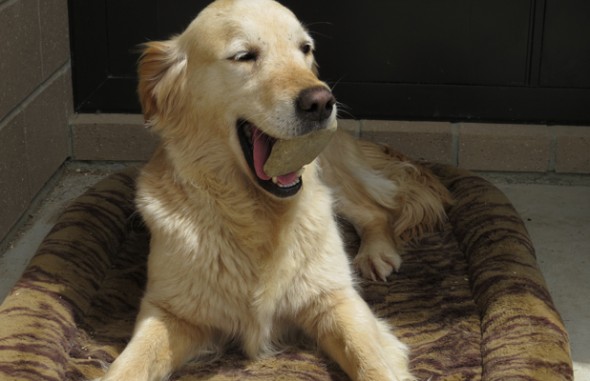
Find the location of `wall`. wall is located at coordinates (30, 124).